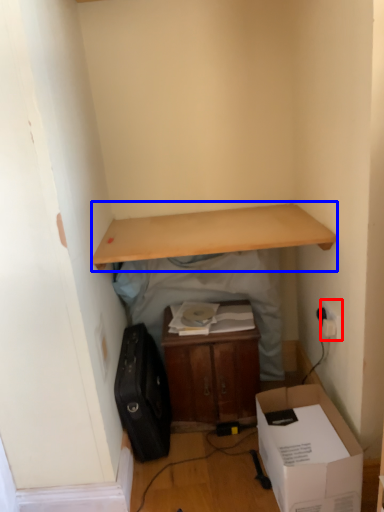
Question: Which of the following is the farthest to the observer, electric outlet (highlighted by a red box) or desk (highlighted by a blue box)?

Choices:
 (A) electric outlet
 (B) desk

Answer: (A)